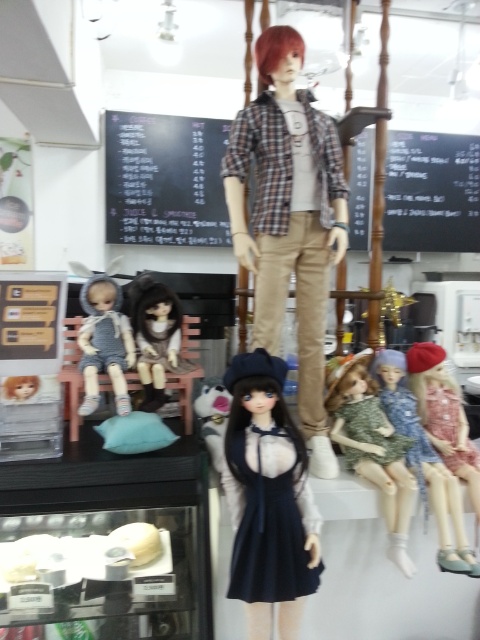
Does plaid fabric doll at center have a lesser height compared to matte pink dress at center?

Incorrect, plaid fabric doll at center's height does not fall short of matte pink dress at center's.

Is point (300, 148) positioned in front of point (405, 404)?

Yes, point (300, 148) is closer to viewer.

Does point (273, 109) come behind point (396, 371)?

No, (273, 109) is in front of (396, 371).

Where is `plaid fabric doll at center`? Image resolution: width=480 pixels, height=640 pixels. plaid fabric doll at center is located at coordinates (289, 218).

Does satin black dress at center have a smaller size compared to shiny brown hair at center?

No.

Which is above, satin black dress at center or shiny brown hair at center?

Positioned higher is shiny brown hair at center.

Based on the photo, who is more forward, (307, 573) or (166, 305)?

Point (307, 573) is in front.

The image size is (480, 640). Find the location of `satin black dress at center`. satin black dress at center is located at coordinates (267, 499).

Who is taller, blackboard at upper center or shiny brown hair at center?

With more height is blackboard at upper center.

Which is behind, point (398, 218) or point (163, 298)?

The point (398, 218) is more distant.

Identify the location of blackboard at upper center. This screenshot has height=640, width=480. (432, 193).